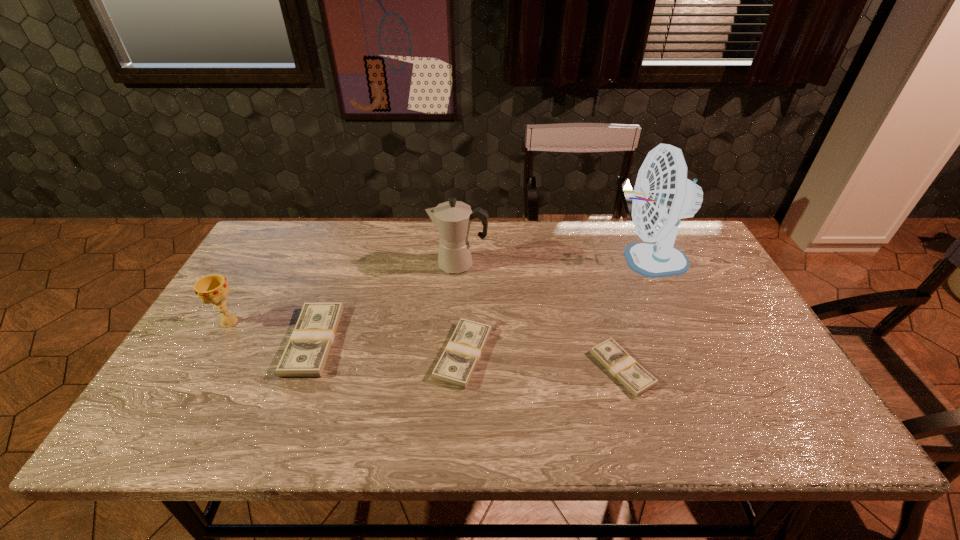
You are a GUI agent. You are given a task and a screenshot of the screen. Output one action in this format:
    pyautogui.click(x=<x>, y=<y>)
    Task: Click on the second object from left to right
    
    Given the screenshot: What is the action you would take?
    pyautogui.click(x=306, y=354)

Locate an element on the screen. The height and width of the screenshot is (540, 960). the third shortest object is located at coordinates (306, 354).

Locate an element on the screen. Image resolution: width=960 pixels, height=540 pixels. the second dollar from right to left is located at coordinates (456, 365).

Image resolution: width=960 pixels, height=540 pixels. In order to click on the second tallest dollar in this screenshot , I will do `click(456, 365)`.

At what (x,y) coordinates should I click in order to perform the action: click on the rightmost dollar. Please return your answer as a coordinate pair (x, y). Image resolution: width=960 pixels, height=540 pixels. Looking at the image, I should click on (610, 354).

Where is `the shortest object`? Image resolution: width=960 pixels, height=540 pixels. the shortest object is located at coordinates tap(610, 354).

Identify the location of the tallest object. [662, 195].

Locate an element on the screen. This screenshot has height=540, width=960. the fifth shortest object is located at coordinates (452, 219).

Where is `chalice`? The width and height of the screenshot is (960, 540). chalice is located at coordinates (213, 289).

Where is `the leftmost object`? the leftmost object is located at coordinates (213, 289).